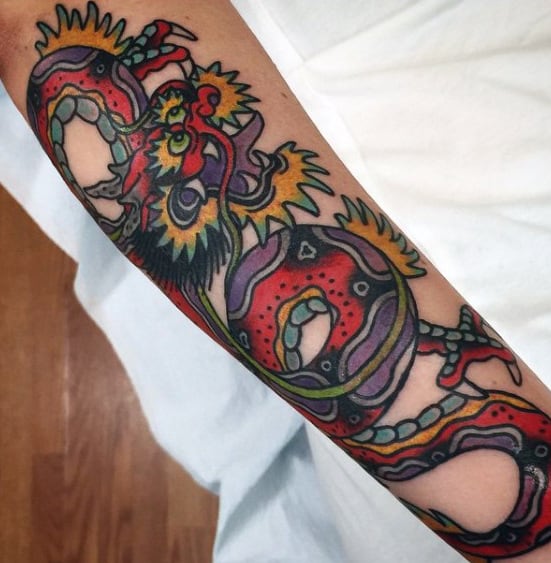
At what (x,y) coordinates should I click in order to perform the action: click on the left of wood floor. Please return your answer as a coordinate pair (x, y). The height and width of the screenshot is (563, 551). Looking at the image, I should click on (0, 185), (0, 324), (1, 452), (1, 561).